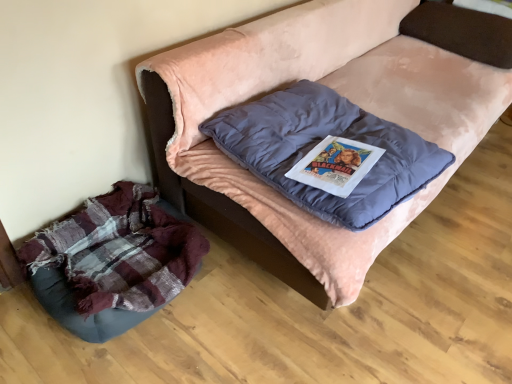
Where is `free space between velvet pink couch at center and plaid fabric dog bed at lower left`? free space between velvet pink couch at center and plaid fabric dog bed at lower left is located at coordinates (219, 330).